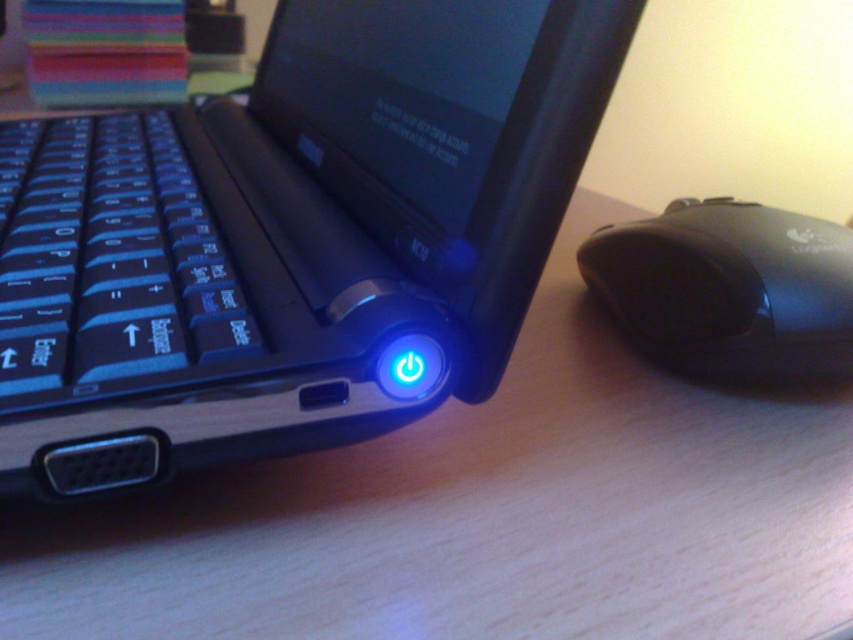
You are setting up a new laptop on the desk. You need to locate the power button and the keyboard. Based on the scene, where is the blue glossy power button at center in relation to the blue matte keyboard at left?

The blue glossy power button at center is above the blue matte keyboard at left.